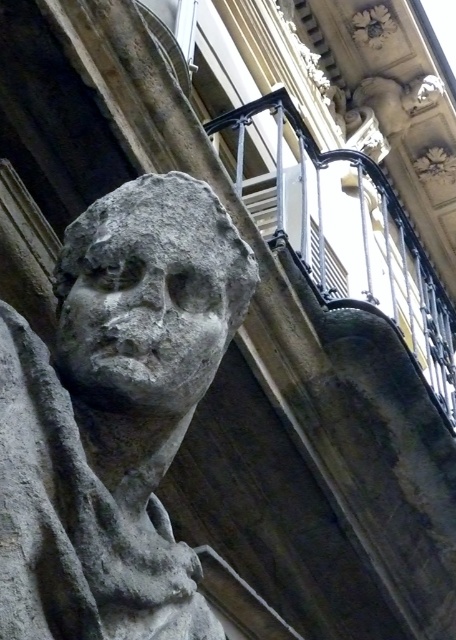
Who is higher up, gray stone bust at center or gray stone face at center?

Positioned higher is gray stone face at center.

Can you confirm if gray stone bust at center is thinner than gray stone face at center?

In fact, gray stone bust at center might be wider than gray stone face at center.

Which is behind, point (108, 470) or point (176, 285)?

Positioned behind is point (176, 285).

Identify the location of gray stone bust at center. (114, 416).